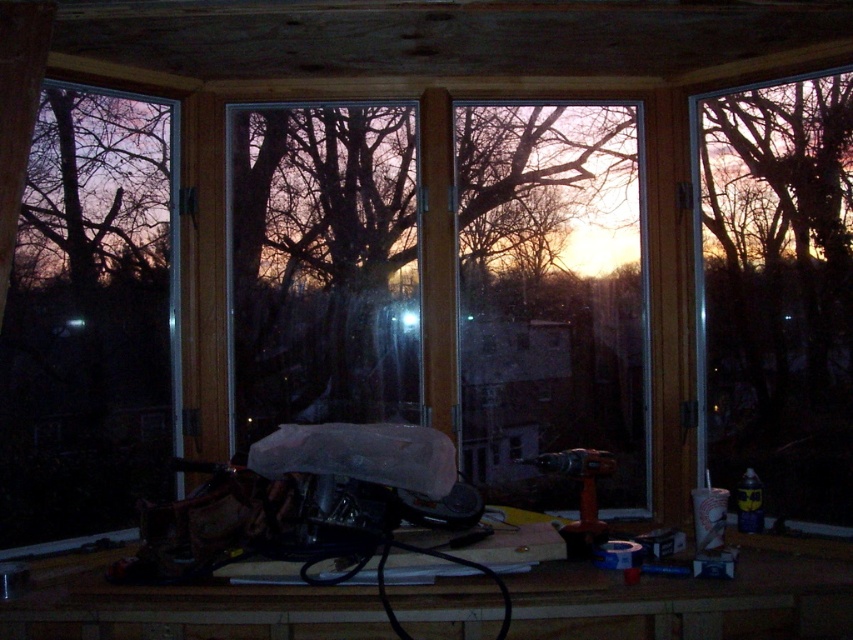
Does transparent glass window at center have a lesser height compared to transparent glass window at right?

Correct, transparent glass window at center is not as tall as transparent glass window at right.

Is transparent glass window at center to the left of transparent glass window at right from the viewer's perspective?

Indeed, transparent glass window at center is positioned on the left side of transparent glass window at right.

Between point (352, 228) and point (834, 221), which one is positioned in front?

Point (834, 221)

Image resolution: width=853 pixels, height=640 pixels. What are the coordinates of `transparent glass window at center` in the screenshot? It's located at click(445, 282).

Does transparent glass window at center lie behind transparent plastic window at left?

Yes.

Can you confirm if transparent glass window at center is wider than transparent plastic window at left?

Yes, transparent glass window at center is wider than transparent plastic window at left.

Who is more forward, (x=308, y=138) or (x=57, y=276)?

Positioned in front is point (x=57, y=276).

Where is `transparent glass window at center`? The height and width of the screenshot is (640, 853). transparent glass window at center is located at coordinates (445, 282).

Between point (132, 337) and point (782, 202), which one is positioned in front?

Positioned in front is point (782, 202).

You are a GUI agent. You are given a task and a screenshot of the screen. Output one action in this format:
    pyautogui.click(x=<x>, y=<y>)
    Task: Click on the transparent plastic window at left
    
    Given the screenshot: What is the action you would take?
    pyautogui.click(x=91, y=321)